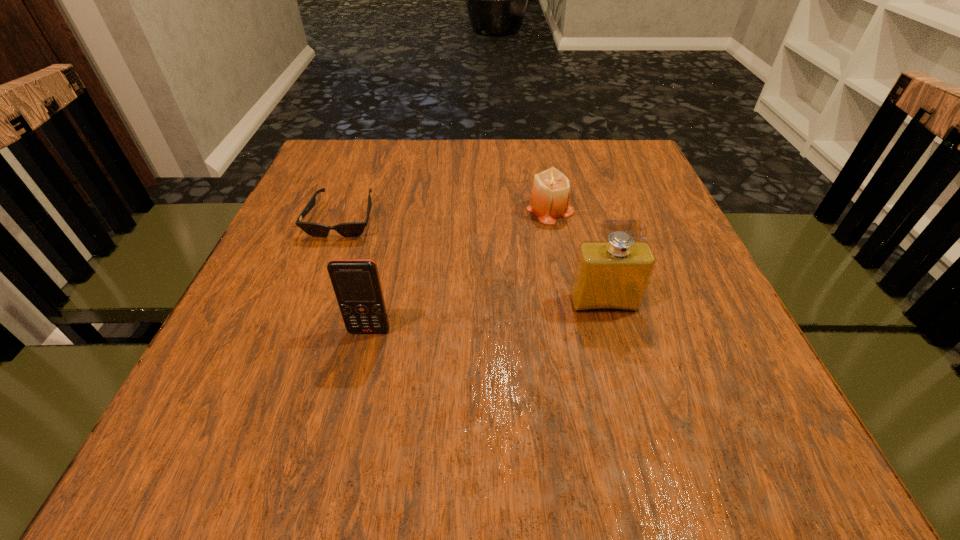
I want to click on the third farthest object, so click(x=609, y=276).

What are the coordinates of `cellular telephone` in the screenshot? It's located at (356, 282).

You are a GUI agent. You are given a task and a screenshot of the screen. Output one action in this format:
    pyautogui.click(x=<x>, y=<y>)
    Task: Click on the third object from right to left
    This screenshot has height=540, width=960.
    Given the screenshot: What is the action you would take?
    pyautogui.click(x=356, y=282)

You are a GUI agent. You are given a task and a screenshot of the screen. Output one action in this format:
    pyautogui.click(x=<x>, y=<y>)
    Task: Click on the candle
    The image size is (960, 540).
    Given the screenshot: What is the action you would take?
    pyautogui.click(x=550, y=194)

Where is `the leftmost object`? the leftmost object is located at coordinates (352, 229).

Identify the location of sunglasses. (352, 229).

Image resolution: width=960 pixels, height=540 pixels. In order to click on vacant region located 0.130m on the front-facing side of the perfume in this screenshot , I will do `click(624, 378)`.

Where is `vacant space located 0.130m on the screen of the nearest object`? This screenshot has height=540, width=960. vacant space located 0.130m on the screen of the nearest object is located at coordinates (352, 406).

Locate an element on the screen. Image resolution: width=960 pixels, height=540 pixels. vacant space located on the left of the third tallest object is located at coordinates (393, 209).

Find the location of a particular element. This screenshot has width=960, height=540. vacant region located on the front-facing side of the shortest object is located at coordinates (303, 323).